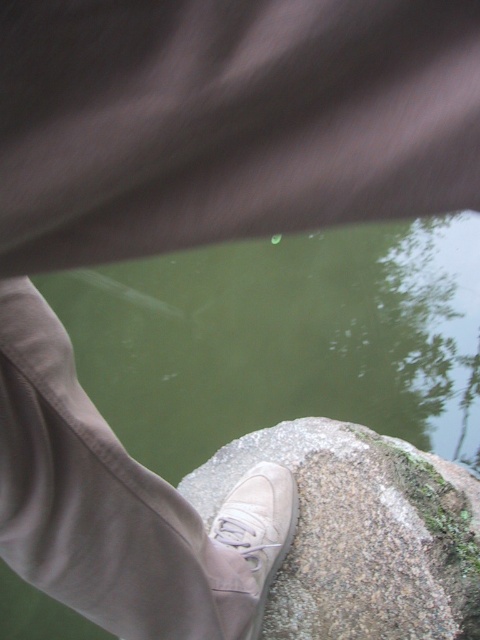
You are standing on a rock by a body of water. You see a point marked at coordinates [285,339]. What is the color of the water at that point?

The point at [285,339] corresponds to green water at center, so the water at that point is green.